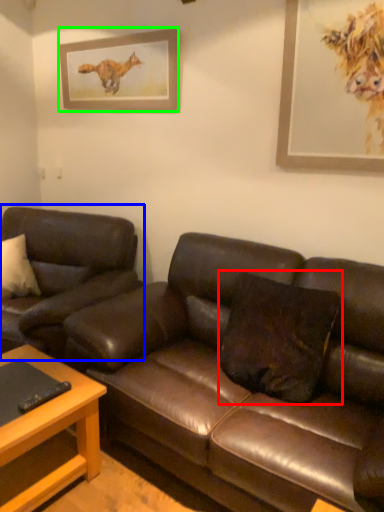
Question: Which object is the closest to the pillow (highlighted by a red box)? Choose among these: studio couch (highlighted by a blue box) or picture frame (highlighted by a green box).

Choices:
 (A) studio couch
 (B) picture frame

Answer: (A)